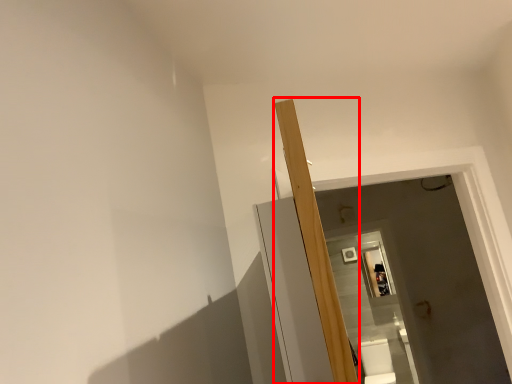
Question: From the image's perspective, what is the correct spatial positioning of beam (annotated by the red box) in reference to toilet bowl?

Choices:
 (A) below
 (B) above

Answer: (B)